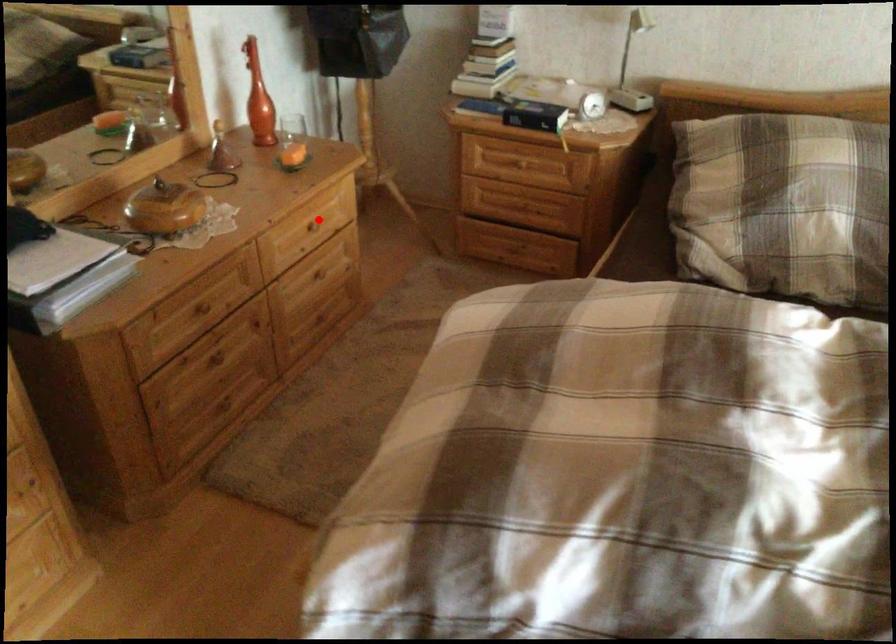
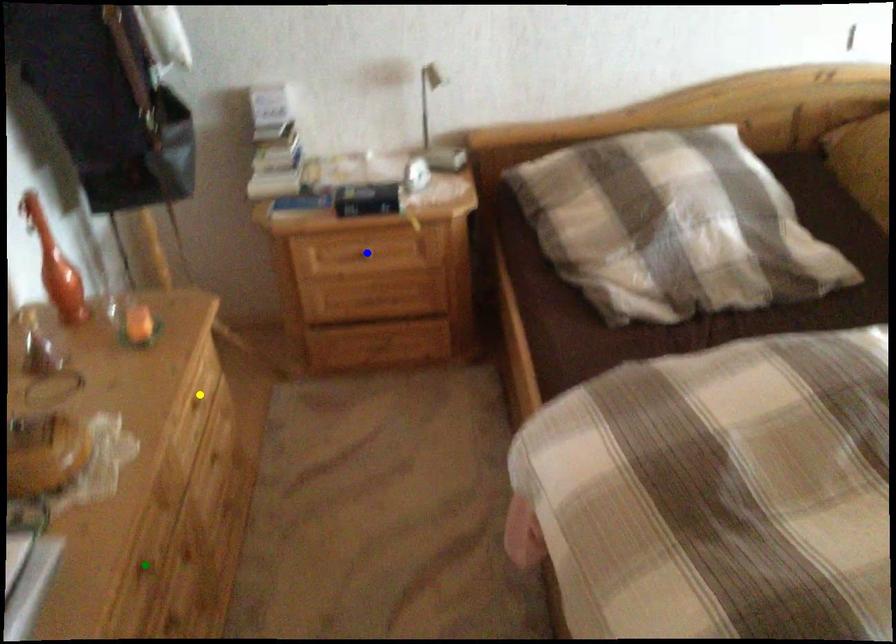
Question: I am providing you with two images of the same scene from different viewpoints. A red point is marked on the first image. You are given multiple points on the second image. Which mark in image 2 goes with the point in image 1?

Choices:
 (A) green point
 (B) yellow point
 (C) blue point

Answer: (B)